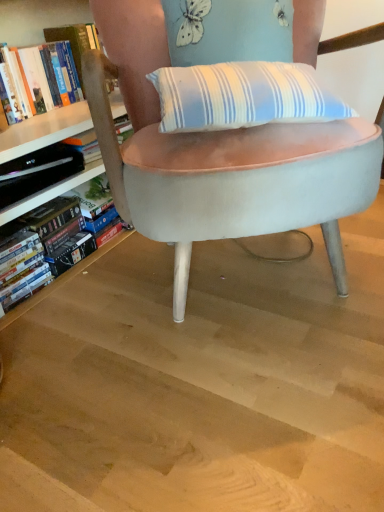
You are a GUI agent. You are given a task and a screenshot of the screen. Output one action in this format:
    pyautogui.click(x=<x>, y=<y>)
    Task: Click on the vacant space in front of velvet light blue chair at center
    The image size is (384, 512).
    Given the screenshot: What is the action you would take?
    pyautogui.click(x=223, y=396)